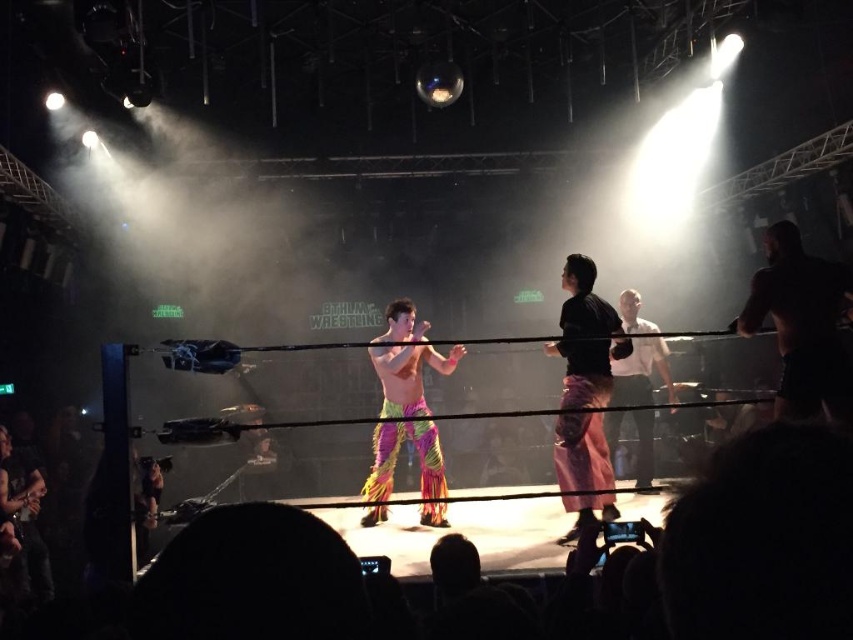
Question: Is multicolored fabric pants at center to the left of white shirt at center from the viewer's perspective?

Choices:
 (A) yes
 (B) no

Answer: (A)

Question: Among these points, which one is farthest from the camera?

Choices:
 (A) (780, 385)
 (B) (608, 506)
 (C) (422, 483)

Answer: (C)

Question: Which of the following is the farthest from the observer?

Choices:
 (A) (381, 444)
 (B) (776, 396)
 (C) (637, 483)

Answer: (C)

Question: Which object is the closest to the black matte shirt at center?

Choices:
 (A) multicolored fabric pants at center
 (B) shiny black hair at right
 (C) white shirt at center

Answer: (C)

Question: Considering the relative positions of black matte shirt at center and white shirt at center in the image provided, where is black matte shirt at center located with respect to white shirt at center?

Choices:
 (A) above
 (B) below

Answer: (A)

Question: Is shiny black hair at right below white shirt at center?

Choices:
 (A) yes
 (B) no

Answer: (B)